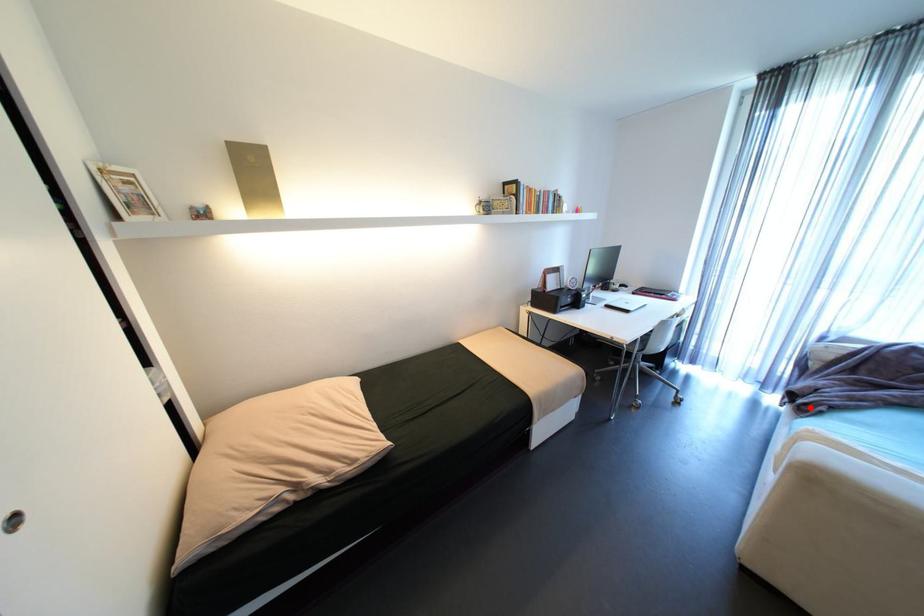
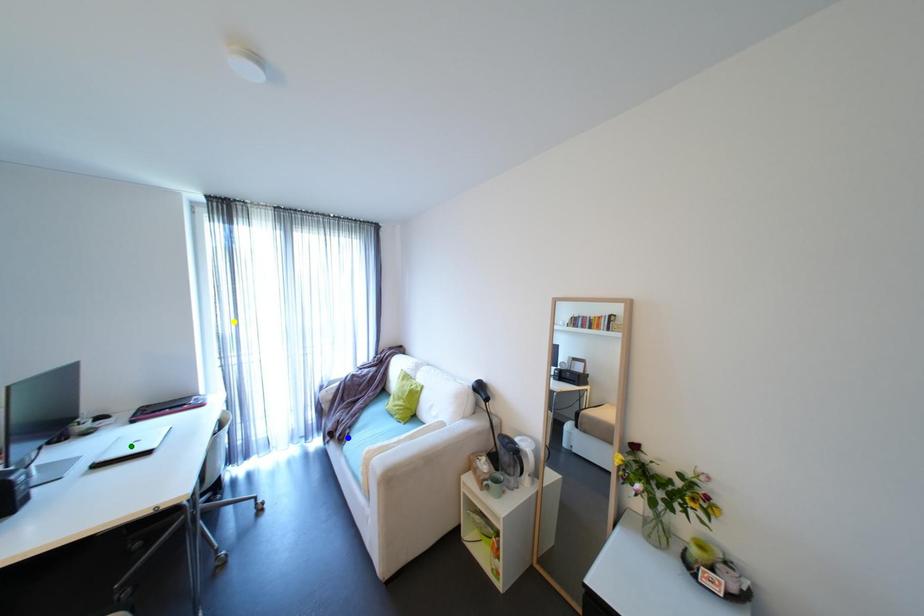
Question: I am providing you with two images of the same scene from different viewpoints. A red point is marked on the first image. You are given multiple points on the second image. Which mark in image 2 goes with the point in image 1?

Choices:
 (A) yellow point
 (B) green point
 (C) blue point

Answer: (C)